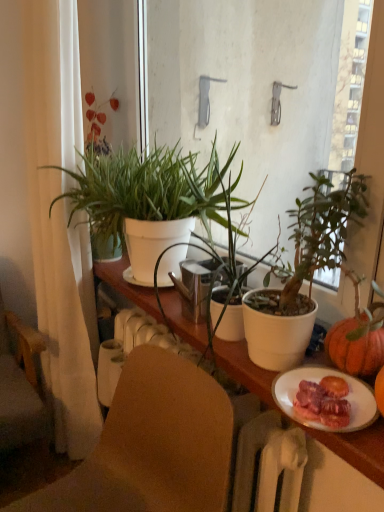
Question: From a real-world perspective, is white matte cabinet at center under white fabric curtain at left?

Choices:
 (A) yes
 (B) no

Answer: (A)

Question: Does white matte cabinet at center have a greater height compared to white fabric curtain at left?

Choices:
 (A) no
 (B) yes

Answer: (A)

Question: From a real-world perspective, is white matte cabinet at center located higher than white fabric curtain at left?

Choices:
 (A) yes
 (B) no

Answer: (B)

Question: Can you confirm if white matte cabinet at center is positioned to the left of white fabric curtain at left?

Choices:
 (A) no
 (B) yes

Answer: (A)

Question: Is white matte cabinet at center in front of white fabric curtain at left?

Choices:
 (A) no
 (B) yes

Answer: (B)

Question: Is white matte cabinet at center smaller than white fabric curtain at left?

Choices:
 (A) no
 (B) yes

Answer: (B)

Question: Is brown fabric chair at lower center, positioned as the second chair in left-to-right order, facing away from green matte plant at center, which is counted as the first houseplant, starting from the front?

Choices:
 (A) no
 (B) yes

Answer: (A)

Question: Is brown fabric chair at lower center, arranged as the 1th chair when viewed from the front, at the left side of green matte plant at center, which is the 2th houseplant in back-to-front order?

Choices:
 (A) yes
 (B) no

Answer: (A)

Question: Does brown fabric chair at lower center, the first chair positioned from the right, lie in front of green matte plant at center, which is counted as the first houseplant, starting from the front?

Choices:
 (A) yes
 (B) no

Answer: (A)

Question: From the image's perspective, does brown fabric chair at lower center, positioned as the second chair in left-to-right order, appear higher than green matte plant at center, which is counted as the first houseplant, starting from the front?

Choices:
 (A) no
 (B) yes

Answer: (A)

Question: From a real-world perspective, does brown fabric chair at lower center, the first chair positioned from the right, stand above green matte plant at center, which is the 2th houseplant in back-to-front order?

Choices:
 (A) no
 (B) yes

Answer: (A)

Question: Does brown fabric chair at lower center, the first chair positioned from the right, have a greater height compared to green matte plant at center, which is the 2th houseplant in back-to-front order?

Choices:
 (A) yes
 (B) no

Answer: (A)

Question: Is green matte plant at center, which is the 2th houseplant in back-to-front order, aimed at white fabric curtain at left?

Choices:
 (A) yes
 (B) no

Answer: (B)